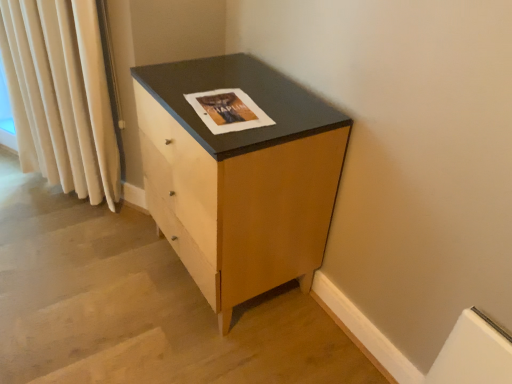
Locate an element on the screen. The image size is (512, 384). free region on the left part of matte wood chest of drawers at center is located at coordinates (95, 276).